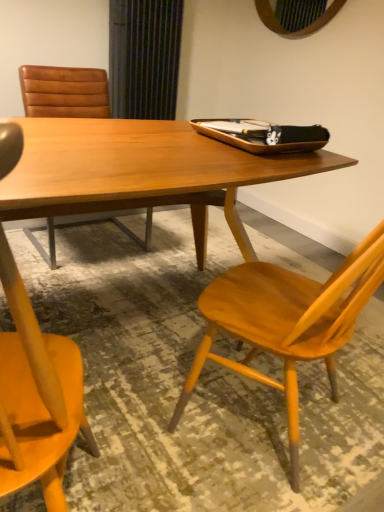
Question: Is brown leather chair at upper left, which is the 1th chair in left-to-right order, wider or thinner than wooden chair at right, the second chair in the back-to-front sequence?

Choices:
 (A) thin
 (B) wide

Answer: (B)

Question: Considering the positions of brown leather chair at upper left, the 1th chair positioned from the back, and wooden chair at right, which appears as the 2th chair when viewed from the left, in the image, is brown leather chair at upper left, the 1th chair positioned from the back, taller or shorter than wooden chair at right, which appears as the 2th chair when viewed from the left,?

Choices:
 (A) short
 (B) tall

Answer: (A)

Question: Which of these objects is positioned farthest from the wooden table at center?

Choices:
 (A) wooden chair at right, the 1th chair viewed from the right
 (B) brown leather chair at upper left, which appears as the second chair when viewed from the front

Answer: (B)

Question: Which of these objects is positioned farthest from the wooden chair at right, which is the 1th chair from front to back?

Choices:
 (A) brown leather chair at upper left, the 1th chair positioned from the back
 (B) wooden table at center

Answer: (A)